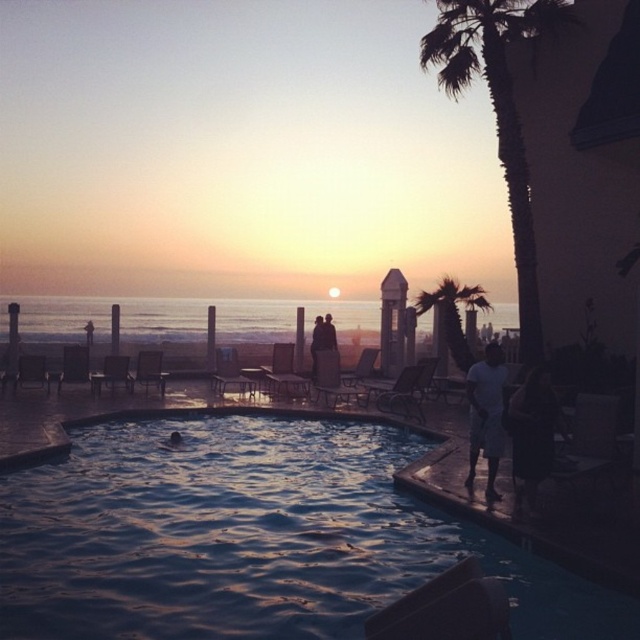
You are a guest at this poolside area and need to retrieve your dark fabric bag at lower right. However, you are currently standing near the green leafy palm tree at upper right. Can you directly see your bag without moving from your current position?

The dark fabric bag at lower right is in front of the green leafy palm tree at upper right, so you can see it directly from your current position near the green leafy palm tree at upper right.

You are planning to place a small umbrella exactly between the shiny blue water at center and the dark fabric bag at lower right. Which object will the umbrella be closer to?

The umbrella will be closer to the dark fabric bag at lower right because the shiny blue water at center is larger in size than the dark fabric bag at lower right.